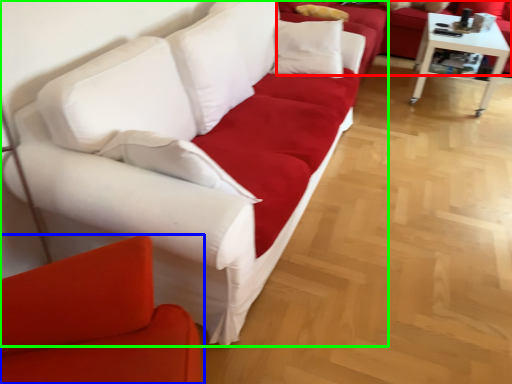
Question: Based on their relative distances, which object is farther from studio couch (highlighted by a red box)? Choose from studio couch (highlighted by a blue box) and studio couch (highlighted by a green box).

Choices:
 (A) studio couch
 (B) studio couch

Answer: (A)